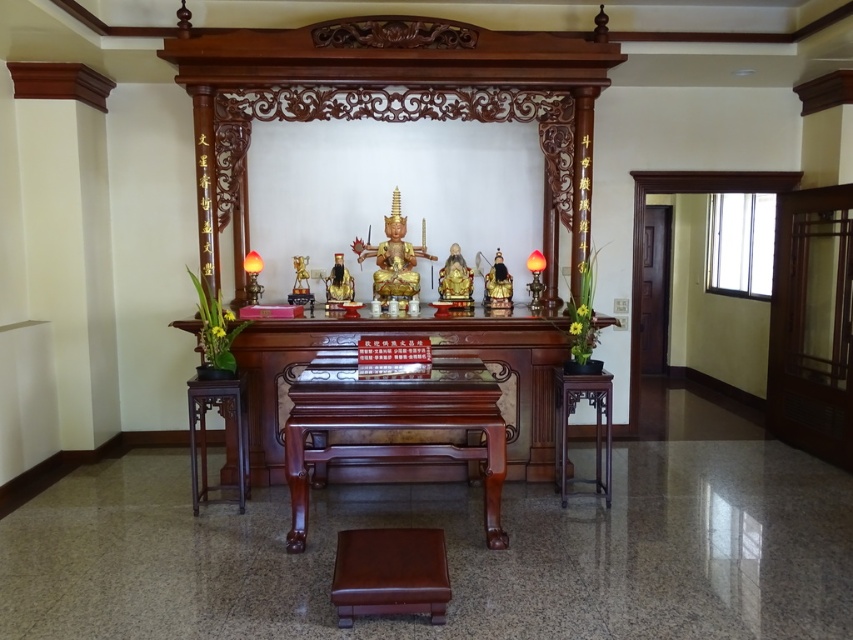
Between polished dark wood altar at center and purple wood table at right, which one has less height?

purple wood table at right is shorter.

Can you confirm if polished dark wood altar at center is taller than purple wood table at right?

Yes.

I want to click on polished dark wood altar at center, so click(x=433, y=355).

In order to click on polished dark wood altar at center in this screenshot , I will do `click(433, 355)`.

Can you confirm if polished dark wood altar at center is taller than brown leather stool at center?

Indeed, polished dark wood altar at center has a greater height compared to brown leather stool at center.

Does point (514, 321) come closer to viewer compared to point (419, 556)?

No.

Between point (436, 348) and point (395, 611), which one is positioned behind?

Positioned behind is point (436, 348).

Find the location of a particular element. polished dark wood altar at center is located at coordinates (433, 355).

Measure the distance between point (202, 476) and camera.

Point (202, 476) and camera are 14.73 feet apart from each other.

Measure the distance between brown polished wood stool at lower left and camera.

brown polished wood stool at lower left and camera are 4.23 meters apart.

Does point (247, 436) come closer to viewer compared to point (250, 260)?

Yes, it is.

You are a GUI agent. You are given a task and a screenshot of the screen. Output one action in this format:
    pyautogui.click(x=<x>, y=<y>)
    Task: Click on the brown polished wood stool at lower left
    The width and height of the screenshot is (853, 640).
    Given the screenshot: What is the action you would take?
    pyautogui.click(x=206, y=433)